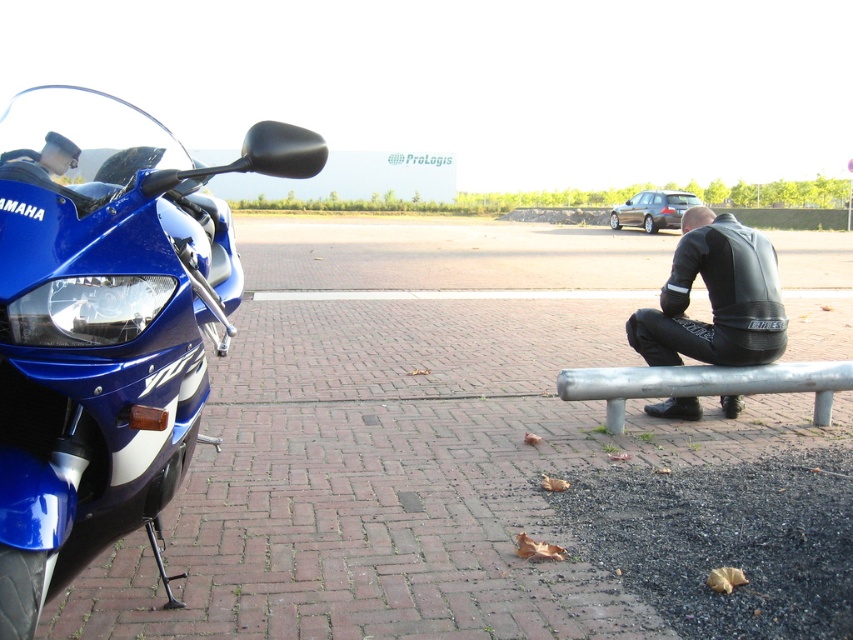
This screenshot has width=853, height=640. What do you see at coordinates (410, 438) in the screenshot? I see `brick pavement at lower left` at bounding box center [410, 438].

Measure the distance between brick pavement at lower left and camera.

The distance of brick pavement at lower left from camera is 8.34 feet.

Does point (289, 262) come closer to viewer compared to point (769, 390)?

No.

Locate an element on the screen. The image size is (853, 640). brick pavement at lower left is located at coordinates [x=410, y=438].

Is black leather jacket at center thinner than silver metallic bench at lower right?

Correct, black leather jacket at center's width is less than silver metallic bench at lower right's.

Is black leather jacket at center smaller than silver metallic bench at lower right?

Incorrect, black leather jacket at center is not smaller in size than silver metallic bench at lower right.

I want to click on black leather jacket at center, so click(715, 298).

Is point (68, 317) less distant than point (744, 248)?

Yes.

Which of these two, blue glossy motorcycle at left or black leather jacket at center, stands shorter?

With less height is black leather jacket at center.

Between point (109, 317) and point (672, 260), which one is positioned behind?

The point (672, 260) is behind.

This screenshot has width=853, height=640. I want to click on blue glossy motorcycle at left, so click(x=106, y=324).